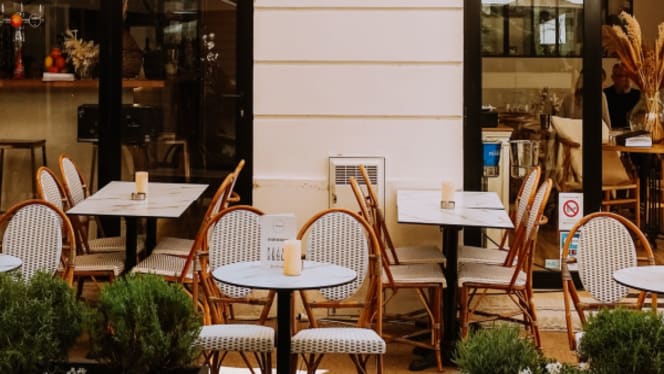
Where is `windows`? The image size is (664, 374). windows is located at coordinates (62, 52), (147, 63), (507, 49), (614, 62).